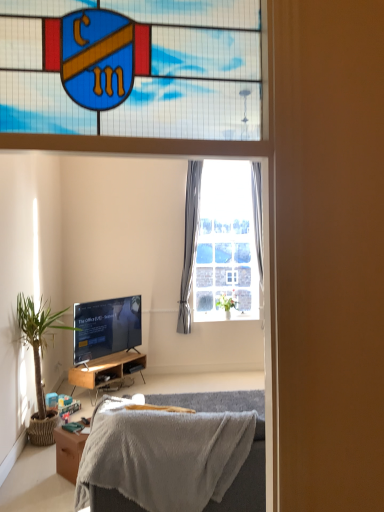
Question: Is green leafy plant at left, the 1th houseplant positioned from the front, oriented away from soft gray blanket at lower center?

Choices:
 (A) yes
 (B) no

Answer: (B)

Question: Considering the relative sizes of green leafy plant at left, placed as the 1th houseplant when sorted from left to right, and soft gray blanket at lower center in the image provided, is green leafy plant at left, placed as the 1th houseplant when sorted from left to right, thinner than soft gray blanket at lower center?

Choices:
 (A) yes
 (B) no

Answer: (A)

Question: Is green leafy plant at left, placed as the 1th houseplant when sorted from left to right, completely or partially outside of soft gray blanket at lower center?

Choices:
 (A) yes
 (B) no

Answer: (A)

Question: Does green leafy plant at left, placed as the 1th houseplant when sorted from left to right, contain soft gray blanket at lower center?

Choices:
 (A) yes
 (B) no

Answer: (B)

Question: From the image's perspective, is green leafy plant at left, marked as the 2th houseplant in a right-to-left arrangement, on soft gray blanket at lower center?

Choices:
 (A) no
 (B) yes

Answer: (B)

Question: From a real-world perspective, is gray fabric curtain at upper center, the 2th curtain viewed from the left, physically located above or below white sheer curtain at center, the 2th curtain when ordered from right to left?

Choices:
 (A) below
 (B) above

Answer: (B)

Question: Is point (258, 233) closer or farther from the camera than point (188, 245)?

Choices:
 (A) farther
 (B) closer

Answer: (B)

Question: Is gray fabric curtain at upper center, acting as the first curtain starting from the right, in front of or behind white sheer curtain at center, the 2th curtain when ordered from right to left, in the image?

Choices:
 (A) front
 (B) behind

Answer: (B)

Question: From the image's perspective, is gray fabric curtain at upper center, acting as the first curtain starting from the right, above or below white sheer curtain at center, which ranks as the 1th curtain in left-to-right order?

Choices:
 (A) above
 (B) below

Answer: (A)

Question: Is point (79, 452) closer or farther from the camera than point (84, 315)?

Choices:
 (A) closer
 (B) farther

Answer: (A)

Question: In terms of width, does wooden desk at lower left look wider or thinner when compared to matte black tv at lower left?

Choices:
 (A) thin
 (B) wide

Answer: (B)

Question: Relative to matte black tv at lower left, is wooden desk at lower left in front or behind?

Choices:
 (A) behind
 (B) front

Answer: (B)

Question: From a real-world perspective, relative to matte black tv at lower left, is wooden desk at lower left vertically above or below?

Choices:
 (A) below
 (B) above

Answer: (A)

Question: From a real-world perspective, is wooden cabinet at lower left positioned above or below soft gray blanket at lower center?

Choices:
 (A) below
 (B) above

Answer: (A)

Question: Is wooden cabinet at lower left in front of or behind soft gray blanket at lower center in the image?

Choices:
 (A) front
 (B) behind

Answer: (B)